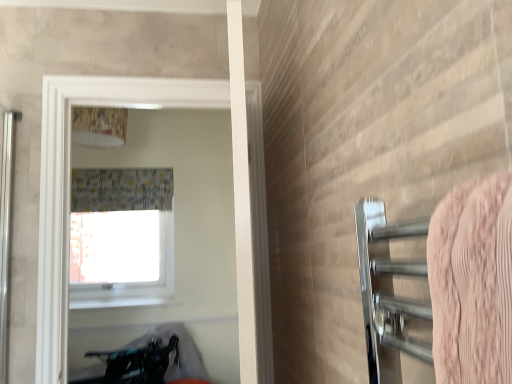
Question: Considering the positions of gray fabric shower curtain at upper center and transparent glass window at upper center in the image, is gray fabric shower curtain at upper center wider or thinner than transparent glass window at upper center?

Choices:
 (A) thin
 (B) wide

Answer: (B)

Question: Is point (106, 183) closer or farther from the camera than point (113, 238)?

Choices:
 (A) closer
 (B) farther

Answer: (A)

Question: Which object is the farthest from the white glossy lampshade at upper center?

Choices:
 (A) white glossy window at upper center
 (B) pink textured towel at right
 (C) gray fabric shower curtain at upper center
 (D) transparent glass window at upper center

Answer: (B)

Question: Estimate the real-world distances between objects in this image. Which object is farther from the pink textured towel at right?

Choices:
 (A) white glossy lampshade at upper center
 (B) white glossy window at upper center
 (C) gray fabric shower curtain at upper center
 (D) transparent glass window at upper center

Answer: (D)